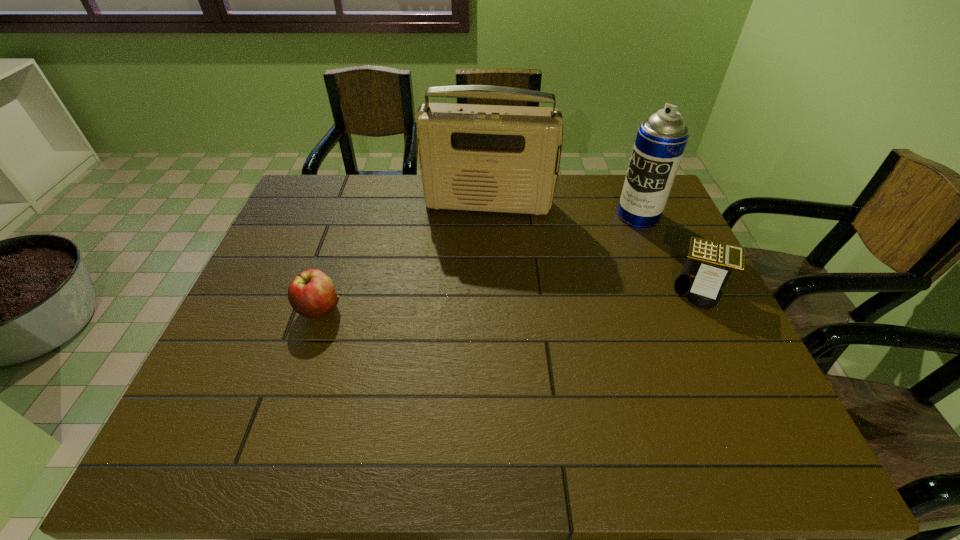
This screenshot has width=960, height=540. I want to click on free space on the desktop that is between the apple and the calculator and is positioned on the label side of the aerosol can, so click(x=542, y=296).

Find the location of a particular element. vacant space on the desktop that is between the leftmost object and the calculator and is positioned on the front-facing side of the second object from left to right is located at coordinates (476, 300).